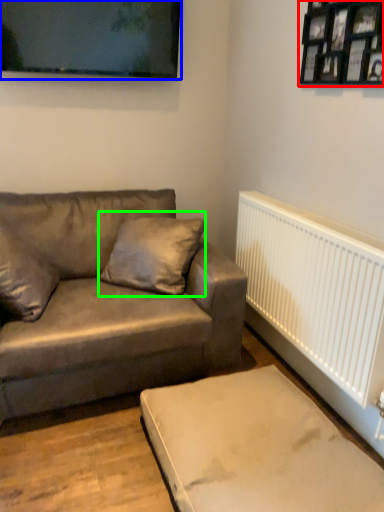
Question: Which object is positioned closest to picture frame (highlighted by a red box)? Select from picture frame (highlighted by a blue box) and pillow (highlighted by a green box).

Choices:
 (A) picture frame
 (B) pillow

Answer: (A)